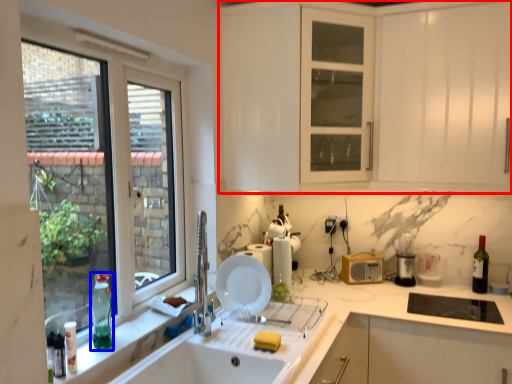
Question: Which object is closer to the camera taking this photo, cabinetry (highlighted by a red box) or bottle (highlighted by a blue box)?

Choices:
 (A) cabinetry
 (B) bottle

Answer: (B)